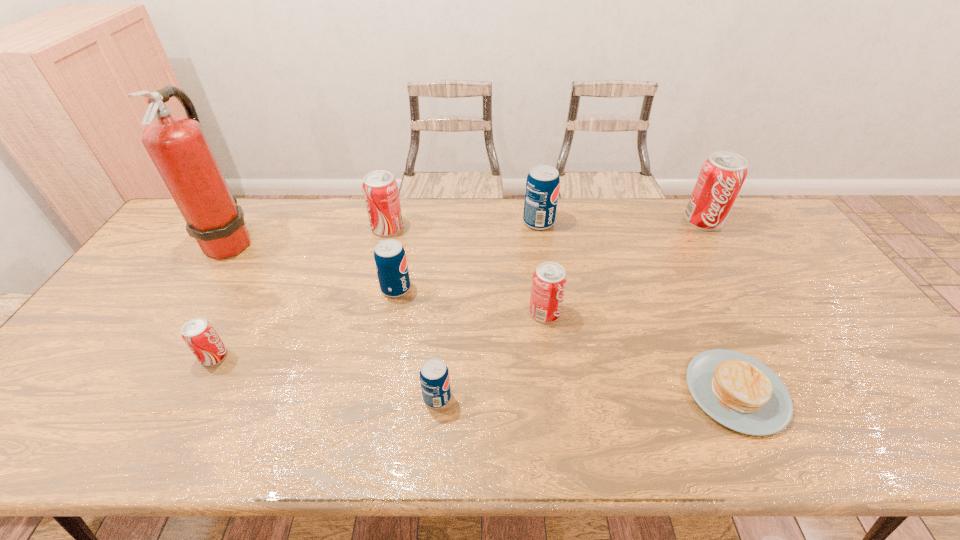
At what (x,y) coordinates should I click in order to perform the action: click on the leftmost object. Please return your answer as a coordinate pair (x, y). The image size is (960, 540). Looking at the image, I should click on (178, 147).

The height and width of the screenshot is (540, 960). I want to click on red fire extinguisher, so click(178, 147).

Image resolution: width=960 pixels, height=540 pixels. I want to click on the tallest pop, so (x=722, y=175).

Locate an element on the screen. The image size is (960, 540). the biggest red soda can is located at coordinates (722, 175).

I want to click on the third red soda can from right to left, so click(x=380, y=189).

Locate an element on the screen. The width and height of the screenshot is (960, 540). the biggest blue pop is located at coordinates (543, 182).

Find the location of a particular element. This screenshot has width=960, height=540. the rightmost blue pop is located at coordinates (543, 182).

Identify the location of the second smallest blue pop. (390, 259).

I want to click on the fifth farthest object, so coord(390,259).

Identify the location of the sixth farthest object. (549, 281).